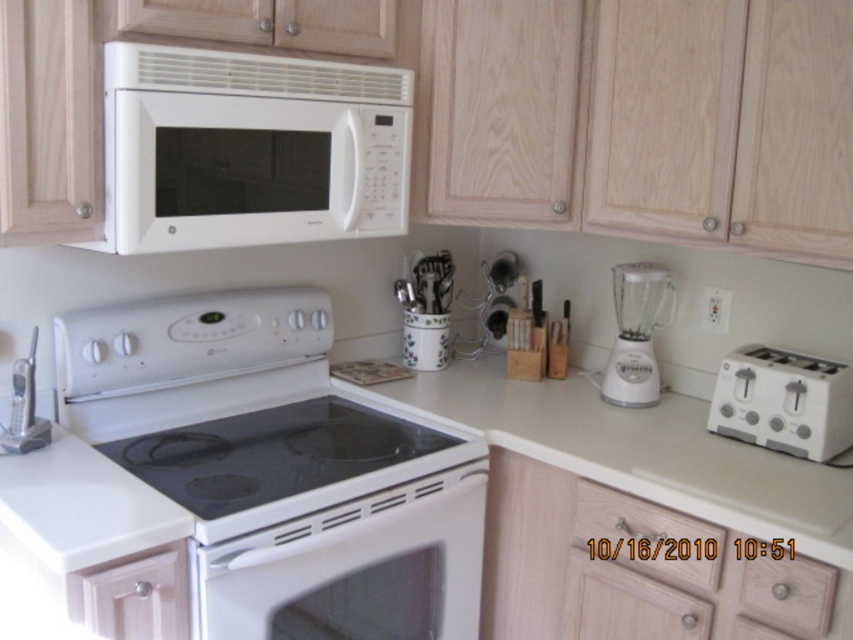
Question: Which object is farther from the camera taking this photo?

Choices:
 (A) white matte microwave at upper center
 (B) white glossy oven at center
 (C) white laminate counter at center
 (D) white wood drawer at lower left

Answer: (A)

Question: Is wooden at lower center wider than white wood drawer at lower left?

Choices:
 (A) yes
 (B) no

Answer: (A)

Question: Estimate the real-world distances between objects in this image. Which object is closer to the light wood drawer at lower right?

Choices:
 (A) white wood drawer at lower left
 (B) white matte microwave at upper center
 (C) white plastic toaster at right

Answer: (C)

Question: Does white plastic toaster at right have a smaller size compared to white plastic blender at right?

Choices:
 (A) yes
 (B) no

Answer: (A)

Question: Which object is positioned farthest from the white glossy oven at center?

Choices:
 (A) white laminate counter at center
 (B) white glossy electric stove at center
 (C) light wood drawer at lower right

Answer: (C)

Question: Can you confirm if white plastic toaster at right is positioned above white wood drawer at lower left?

Choices:
 (A) no
 (B) yes

Answer: (B)